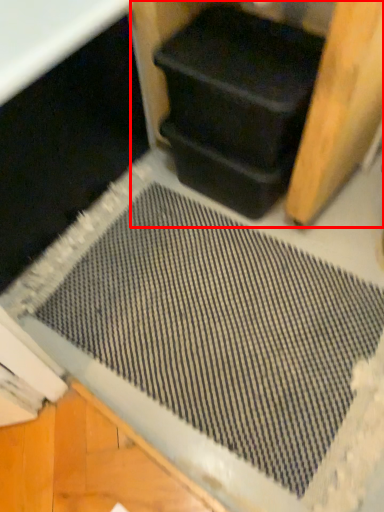
Question: Observing the image, what is the correct spatial positioning of wood (annotated by the red box) in reference to wide?

Choices:
 (A) right
 (B) left

Answer: (A)